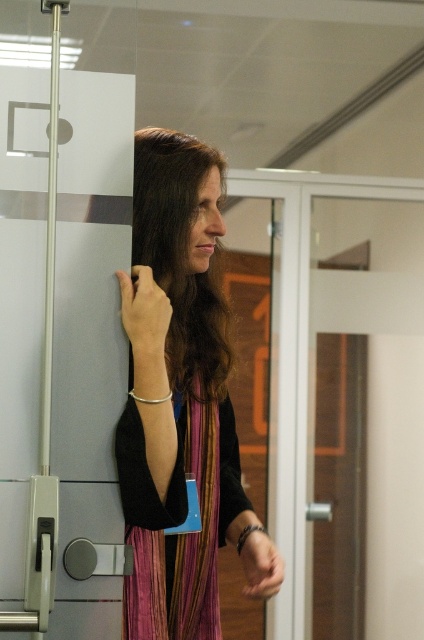
Between transparent glass door at center and matte black hand at lower center, which one has less height?

matte black hand at lower center is shorter.

Does transparent glass door at center have a greater height compared to matte black hand at lower center?

Indeed, transparent glass door at center has a greater height compared to matte black hand at lower center.

The image size is (424, 640). I want to click on transparent glass door at center, so click(x=296, y=364).

Where is `transparent glass door at center`? transparent glass door at center is located at coordinates (296, 364).

Measure the distance between smooth skin hand at upper left and matte black hand at lower center.

They are 18.57 inches apart.

Does smooth skin hand at upper left appear on the left side of matte black hand at lower center?

Correct, you'll find smooth skin hand at upper left to the left of matte black hand at lower center.

Locate an element on the screen. smooth skin hand at upper left is located at coordinates (144, 314).

Does multicolored striped dress at center have a greater height compared to transparent glass door at center?

Incorrect, multicolored striped dress at center's height is not larger of transparent glass door at center's.

Between point (222, 353) and point (363, 182), which one is positioned in front?

Point (222, 353) is in front.

Locate an element on the screen. The height and width of the screenshot is (640, 424). multicolored striped dress at center is located at coordinates (175, 392).